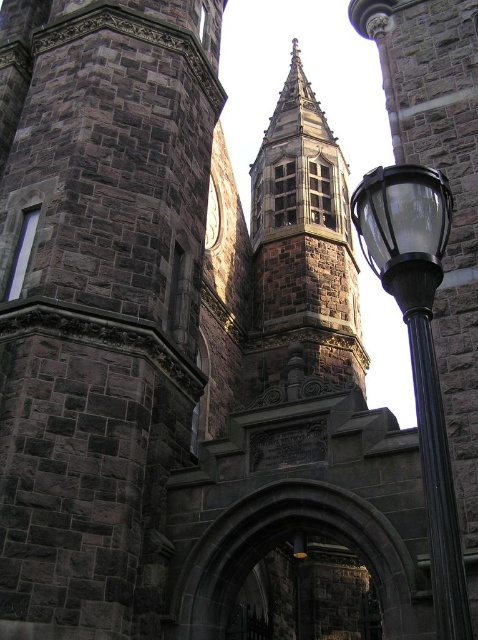
You are standing in front of the historic stone building and want to take a photo of the dark gray stone tower at center and the black polished metal street light at right. Which object should you focus on first to ensure both are in the frame?

You should focus on the dark gray stone tower at center first because it is closer to you than the black polished metal street light at right, so it will be in focus first, and then adjust to include both in the frame.